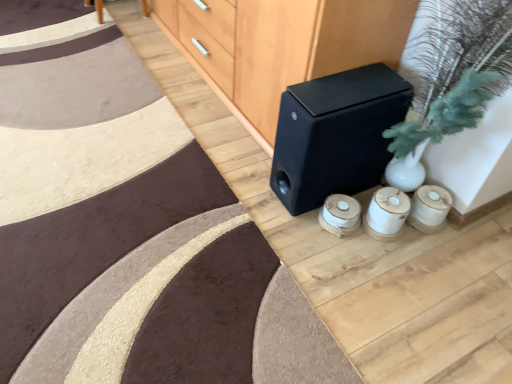
Question: Is black matte speaker at center in front of or behind black matte speaker at center in the image?

Choices:
 (A) behind
 (B) front

Answer: (B)

Question: Considering the positions of black matte speaker at center and black matte speaker at center in the image, is black matte speaker at center wider or thinner than black matte speaker at center?

Choices:
 (A) wide
 (B) thin

Answer: (A)

Question: From a real-world perspective, relative to black matte speaker at center, is black matte speaker at center vertically above or below?

Choices:
 (A) below
 (B) above

Answer: (B)

Question: Is black matte speaker at center inside the boundaries of black matte speaker at center, or outside?

Choices:
 (A) inside
 (B) outside

Answer: (B)

Question: From the image's perspective, is black matte speaker at center positioned above or below black matte speaker at center?

Choices:
 (A) above
 (B) below

Answer: (B)

Question: Considering the positions of black matte speaker at center and black matte speaker at center in the image, is black matte speaker at center taller or shorter than black matte speaker at center?

Choices:
 (A) short
 (B) tall

Answer: (A)

Question: Is black matte speaker at center to the left or to the right of black matte speaker at center in the image?

Choices:
 (A) right
 (B) left

Answer: (A)